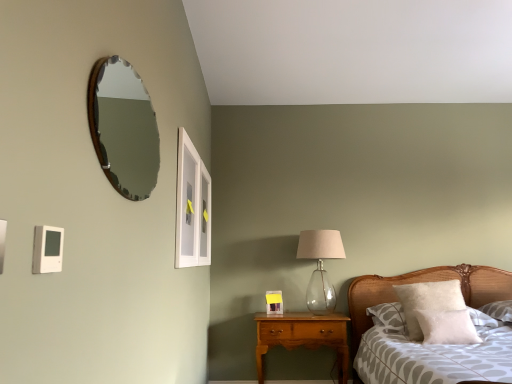
Question: Considering the positions of white fluffy pillow at right, placed as the first pillow when sorted from back to front, and matte white picture frame at center in the image, is white fluffy pillow at right, placed as the first pillow when sorted from back to front, taller or shorter than matte white picture frame at center?

Choices:
 (A) tall
 (B) short

Answer: (A)

Question: In terms of width, does white fluffy pillow at right, marked as the 2th pillow in a front-to-back arrangement, look wider or thinner when compared to matte white picture frame at center?

Choices:
 (A) wide
 (B) thin

Answer: (A)

Question: Considering the real-world distances, which object is farthest from the patterned fabric bed at lower right?

Choices:
 (A) cherry wood nightstand at center
 (B) translucent glass table lamp at center-right
 (C) wooden-framed mirror at upper left
 (D) white fluffy pillow at right, placed as the first pillow when sorted from back to front
 (E) matte white picture frame at center

Answer: (C)

Question: Which object is the farthest from the white fluffy pillow at right, which is the 2th pillow from back to front?

Choices:
 (A) white fluffy pillow at right, marked as the 2th pillow in a front-to-back arrangement
 (B) wooden-framed mirror at upper left
 (C) clear glass window at upper center
 (D) translucent glass table lamp at center-right
 (E) patterned fabric bed at lower right

Answer: (B)